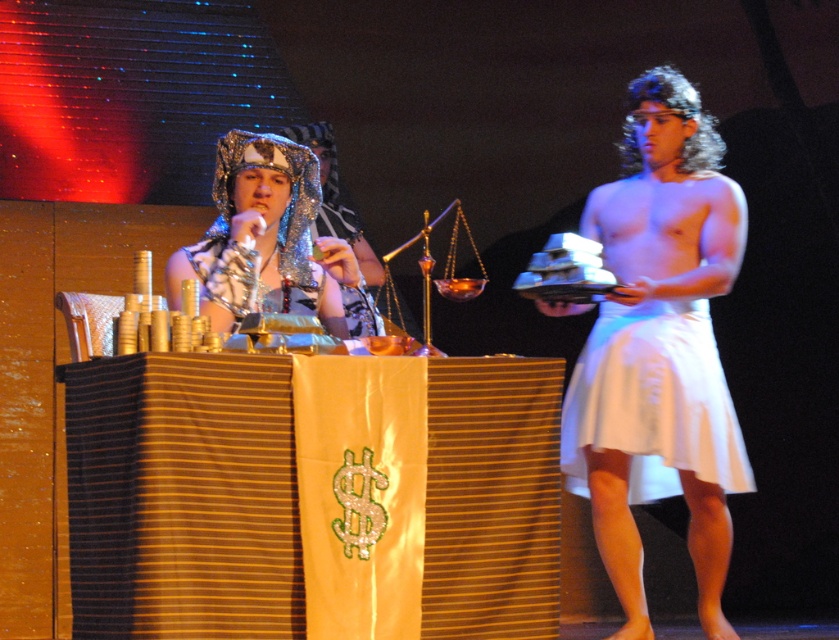
You are a stagehand preparing to move the shiny silver headscarf at center to the left side of the stage. The stage is narrow, and you must pass by the white clothed person at right to reach the headscarf. Can you safely move the headscarf without getting too close to the person?

The white clothed person at right is 3.33 feet away from the shiny silver headscarf at center. Since the distance is sufficient, you can safely move the headscarf without getting too close to the person.

You are an audience member sitting in the front row of the theater. You notice two white items on stage. One is the white clothed person at right and the other is the white cotton skirt at center. Which of these two items is located more to the left side of the stage?

The white clothed person at right is positioned on the left side of the white cotton skirt at center, so the white clothed person at right is more to the left.